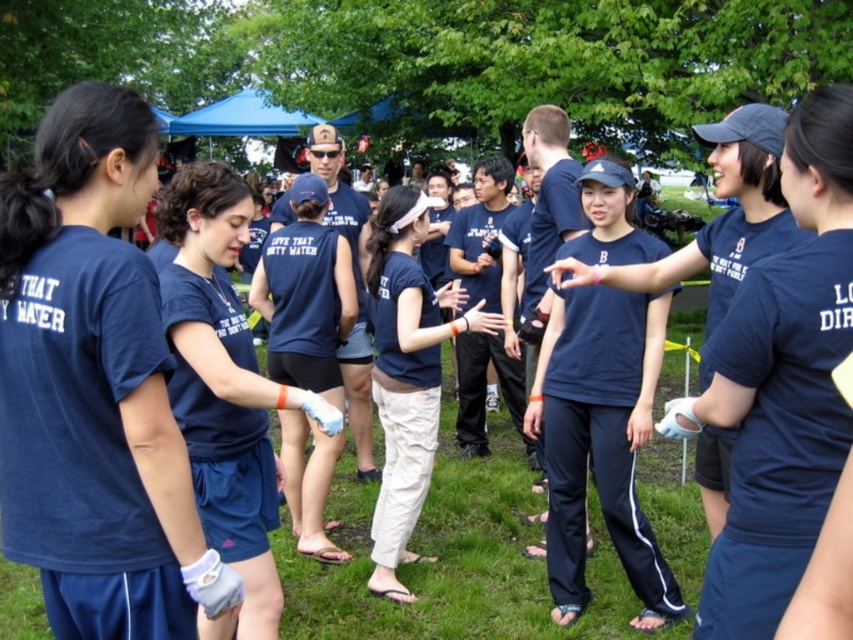
Can you confirm if navy blue jersey at left is positioned below navy blue fabric shirt at center?

Incorrect, navy blue jersey at left is not positioned below navy blue fabric shirt at center.

Looking at this image, is navy blue jersey at left shorter than navy blue fabric shirt at center?

Correct, navy blue jersey at left is not as tall as navy blue fabric shirt at center.

Is point (47, 266) positioned in front of point (383, 285)?

Yes, point (47, 266) is in front of point (383, 285).

Where is `navy blue jersey at left`? The width and height of the screenshot is (853, 640). navy blue jersey at left is located at coordinates (94, 387).

Who is positioned more to the right, navy blue track pants at center or navy blue sleeveless shirt at center?

Positioned to the right is navy blue track pants at center.

Does navy blue track pants at center appear under navy blue sleeveless shirt at center?

Yes, navy blue track pants at center is below navy blue sleeveless shirt at center.

Image resolution: width=853 pixels, height=640 pixels. What do you see at coordinates (601, 442) in the screenshot? I see `navy blue track pants at center` at bounding box center [601, 442].

I want to click on navy blue track pants at center, so click(601, 442).

Can you confirm if navy blue fabric shirt at center is taller than navy blue sleeveless shirt at center?

Incorrect, navy blue fabric shirt at center's height is not larger of navy blue sleeveless shirt at center's.

Can you confirm if navy blue fabric shirt at center is positioned to the right of navy blue sleeveless shirt at center?

Yes, navy blue fabric shirt at center is to the right of navy blue sleeveless shirt at center.

Is point (405, 204) less distant than point (276, 248)?

That is True.

In order to click on navy blue fabric shirt at center in this screenshot , I will do `click(407, 372)`.